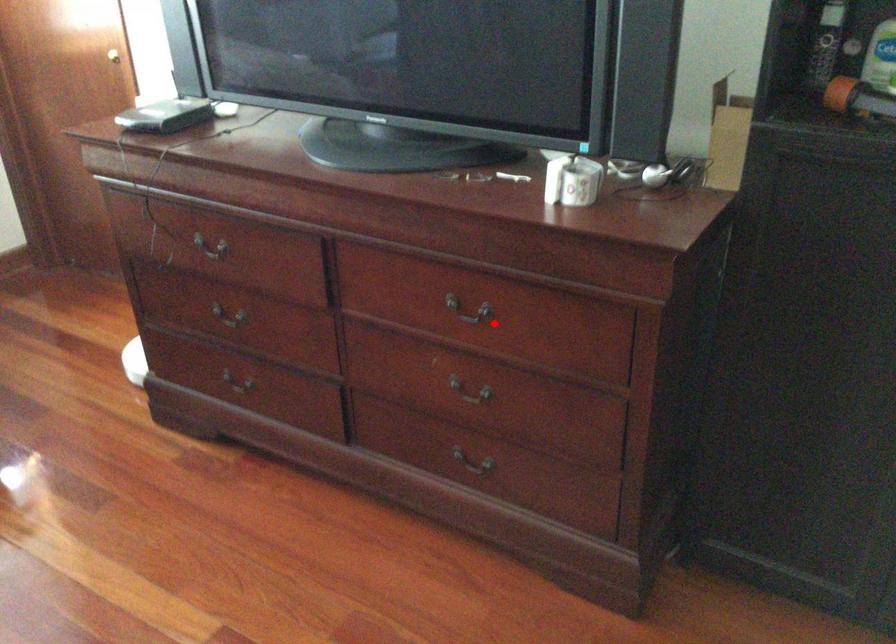
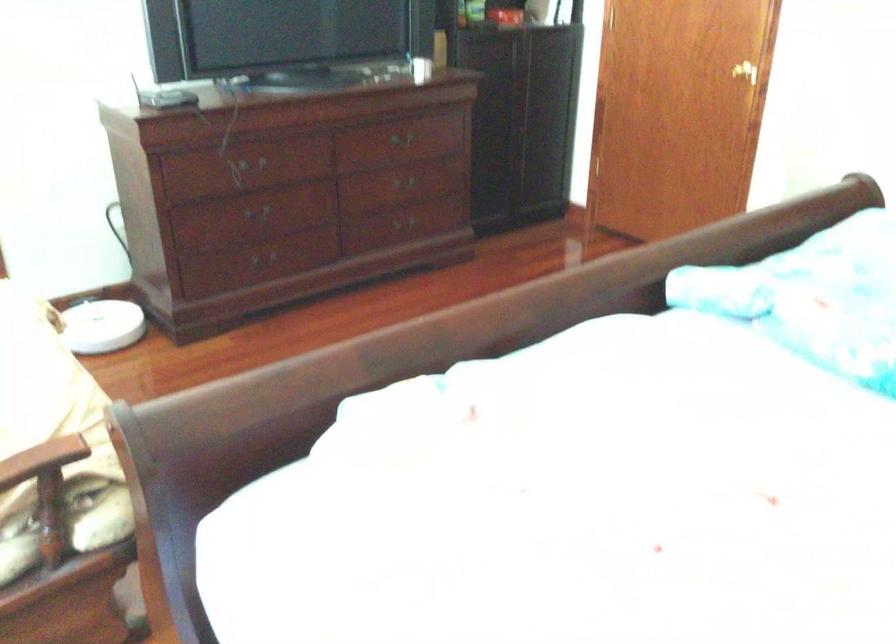
Question: A red point is marked in image1. In image2, is the corresponding 3D point closer to the camera or farther? Reply with the corresponding letter.

Choices:
 (A) The corresponding 3D point is closer.
 (B) The corresponding 3D point is farther.

Answer: (B)